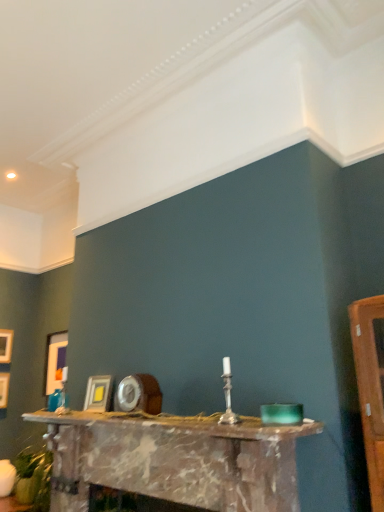
Question: Can you confirm if matte gold picture frame at left, which ranks as the second picture frame in left-to-right order, is positioned to the left of matte gold picture frame at center, marked as the fourth picture frame in a back-to-front arrangement?

Choices:
 (A) yes
 (B) no

Answer: (A)

Question: Can you confirm if matte gold picture frame at left, the third picture frame viewed from the front, is bigger than matte gold picture frame at center, the 1th picture frame viewed from the front?

Choices:
 (A) no
 (B) yes

Answer: (B)

Question: Is matte gold picture frame at left, which ranks as the second picture frame in back-to-front order, taller than matte gold picture frame at center, the 1th picture frame viewed from the front?

Choices:
 (A) yes
 (B) no

Answer: (A)

Question: Is the depth of matte gold picture frame at left, which ranks as the second picture frame in left-to-right order, greater than that of matte gold picture frame at center, the 1th picture frame from the right?

Choices:
 (A) no
 (B) yes

Answer: (B)

Question: Is matte gold picture frame at center, the 1th picture frame viewed from the front, surrounded by matte gold picture frame at left, which ranks as the second picture frame in back-to-front order?

Choices:
 (A) no
 (B) yes

Answer: (A)

Question: Which is correct: matte gold picture frame at center, the 1th picture frame from the right, is inside matte gold picture frame at left, which ranks as the second picture frame in back-to-front order, or outside of it?

Choices:
 (A) outside
 (B) inside

Answer: (A)

Question: Is matte gold picture frame at center, the 1th picture frame from the right, taller or shorter than matte gold picture frame at left, the third picture frame viewed from the front?

Choices:
 (A) short
 (B) tall

Answer: (A)

Question: Is matte gold picture frame at center, the 1th picture frame from the right, wider or thinner than matte gold picture frame at left, arranged as the third picture frame when viewed from the right?

Choices:
 (A) wide
 (B) thin

Answer: (A)

Question: From a real-world perspective, relative to matte gold picture frame at left, arranged as the third picture frame when viewed from the right, is matte gold picture frame at center, the 1th picture frame viewed from the front, vertically above or below?

Choices:
 (A) above
 (B) below

Answer: (B)

Question: Looking at the image, does matte gold picture frame at left, the third picture frame viewed from the front, seem bigger or smaller compared to wooden picture frame at left, which appears as the 1th picture frame when viewed from the back?

Choices:
 (A) small
 (B) big

Answer: (B)

Question: Is matte gold picture frame at left, arranged as the third picture frame when viewed from the right, taller or shorter than wooden picture frame at left, the fourth picture frame in the right-to-left sequence?

Choices:
 (A) short
 (B) tall

Answer: (B)

Question: Is point (1, 378) closer or farther from the camera than point (3, 340)?

Choices:
 (A) farther
 (B) closer

Answer: (B)

Question: From the image's perspective, relative to wooden picture frame at left, positioned as the 4th picture frame in front-to-back order, is matte gold picture frame at left, which ranks as the second picture frame in left-to-right order, above or below?

Choices:
 (A) above
 (B) below

Answer: (B)

Question: Considering the positions of matte gold picture frame at center, the 4th picture frame positioned from the left, and wooden picture frame at left, the fourth picture frame in the right-to-left sequence, in the image, is matte gold picture frame at center, the 4th picture frame positioned from the left, taller or shorter than wooden picture frame at left, the fourth picture frame in the right-to-left sequence,?

Choices:
 (A) short
 (B) tall

Answer: (A)

Question: Is matte gold picture frame at center, marked as the fourth picture frame in a back-to-front arrangement, bigger or smaller than wooden picture frame at left, positioned as the first picture frame in left-to-right order?

Choices:
 (A) small
 (B) big

Answer: (A)